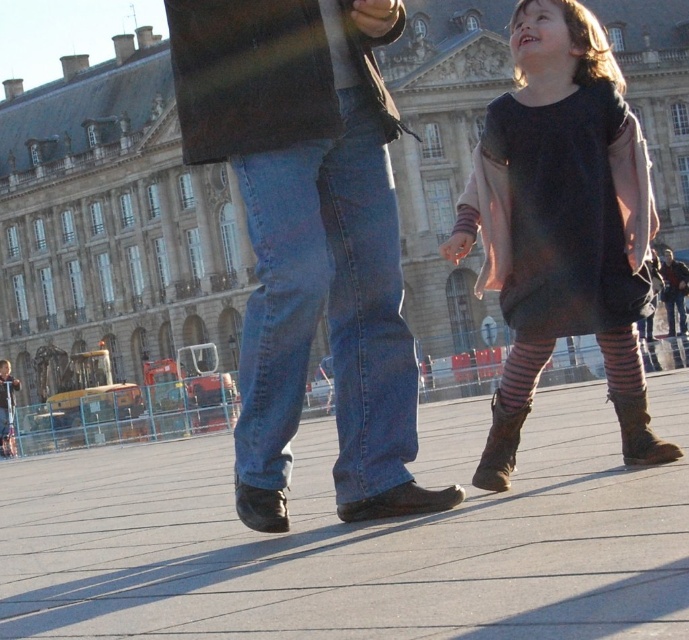
From the picture: Does blue denim jeans at center appear on the left side of brown leather boot at lower right?

Yes, blue denim jeans at center is to the left of brown leather boot at lower right.

This screenshot has height=640, width=689. What do you see at coordinates (327, 307) in the screenshot?
I see `blue denim jeans at center` at bounding box center [327, 307].

Is point (236, 458) closer to camera compared to point (635, 424)?

Yes, point (236, 458) is closer to viewer.

Find the location of `blue denim jeans at center`. blue denim jeans at center is located at coordinates (327, 307).

Is brown suede boot at lower right to the right of striped fabric sock at lower right from the viewer's perspective?

In fact, brown suede boot at lower right is to the left of striped fabric sock at lower right.

Is brown suede boot at lower right positioned in front of striped fabric sock at lower right?

Yes, brown suede boot at lower right is closer to the viewer.

Identify the location of brown suede boot at lower right. This screenshot has height=640, width=689. (500, 445).

Between point (617, 413) and point (520, 348), which one is positioned in front?

Point (617, 413)

Locate an element on the screen. The width and height of the screenshot is (689, 640). brown leather boot at lower right is located at coordinates (639, 432).